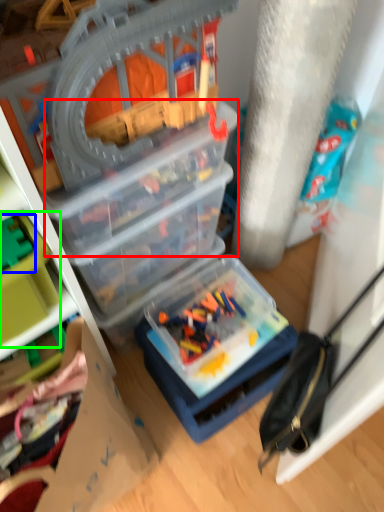
Question: Which is nearer to the box (highlighted by a red box)? toy (highlighted by a blue box) or toy (highlighted by a green box).

Choices:
 (A) toy
 (B) toy

Answer: (B)